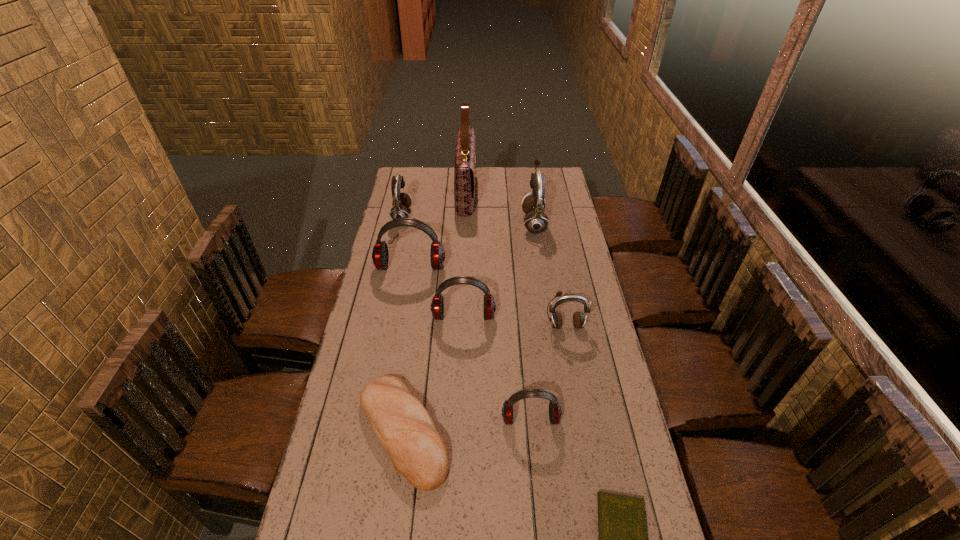
Point out which brown earphone is positioned as the second nearest to the second biggest brown earphone. Please provide its 2D coordinates. Your answer should be formatted as a tuple, i.e. [(x, y)], where the tuple contains the x and y coordinates of a point satisfying the conditions above.

[(556, 319)]

At what (x,y) coordinates should I click in order to perform the action: click on brown earphone that stands as the third closest to the nearest red earphone. Please return your answer as a coordinate pair (x, y). The width and height of the screenshot is (960, 540). Looking at the image, I should click on (401, 202).

Identify which red earphone is located as the third nearest to the tallest earphone. Please provide its 2D coordinates. Your answer should be formatted as a tuple, i.e. [(x, y)], where the tuple contains the x and y coordinates of a point satisfying the conditions above.

[(555, 412)]

Identify the location of red earphone that stands as the second closest to the handbag. (437, 306).

Locate an element on the screen. vacant region that satisfies the following two spatial constraints: 1. on the ear pads of the biggest brown earphone; 2. on the ear cups of the fourth farthest object is located at coordinates (540, 267).

This screenshot has width=960, height=540. Identify the location of blank space that satisfies the following two spatial constraints: 1. on the ear pads of the tallest earphone; 2. on the ear cups of the farthest red earphone. (540, 267).

Identify the location of free spot that satisfies the following two spatial constraints: 1. on the front of the handbag with the clasp; 2. on the ear cups of the biggest red earphone. (464, 267).

Find the location of a particular element. vacant space that satisfies the following two spatial constraints: 1. on the front of the handbag with the clasp; 2. on the ear cups of the biggest red earphone is located at coordinates (464, 267).